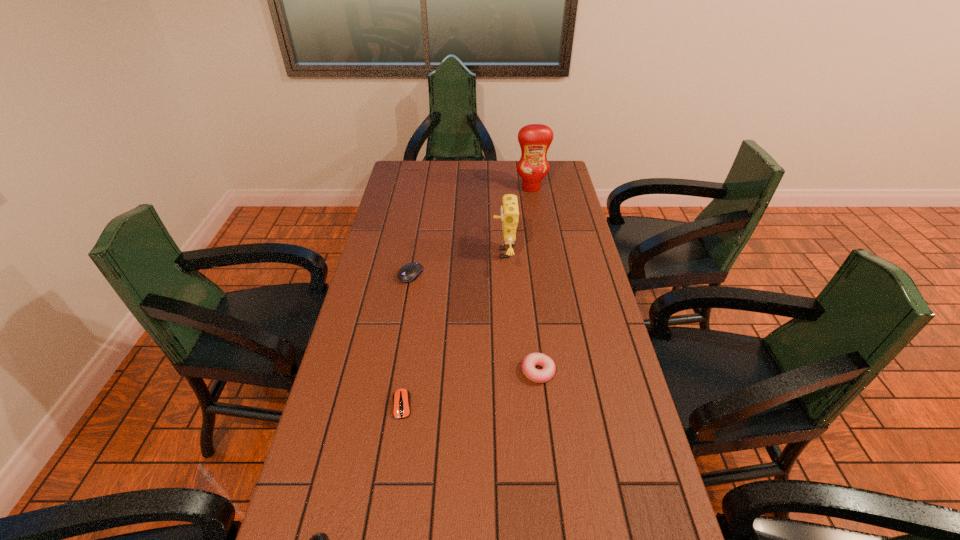
The image size is (960, 540). I want to click on vacant space at the far left corner, so click(x=422, y=173).

At what (x,y) coordinates should I click in order to perform the action: click on vacant point located between the condiment and the second nearest computer mouse. Please return your answer as a coordinate pair (x, y). Looking at the image, I should click on (467, 296).

Image resolution: width=960 pixels, height=540 pixels. I want to click on vacant space that's between the doughnut and the second nearest computer mouse, so click(470, 388).

Where is `free spot between the farthest computer mouse and the third nearest object`? The height and width of the screenshot is (540, 960). free spot between the farthest computer mouse and the third nearest object is located at coordinates (474, 323).

You are a GUI agent. You are given a task and a screenshot of the screen. Output one action in this format:
    pyautogui.click(x=<x>, y=<y>)
    Task: Click on the vacant area between the fifth farthest object and the tallest computer mouse
    This screenshot has width=960, height=540.
    Given the screenshot: What is the action you would take?
    pyautogui.click(x=406, y=340)

You are a GUI agent. You are given a task and a screenshot of the screen. Output one action in this format:
    pyautogui.click(x=<x>, y=<y>)
    Task: Click on the unoccupied area between the tallest computer mouse and the sponge
    This screenshot has width=960, height=540.
    Given the screenshot: What is the action you would take?
    [457, 264]

Find the location of a particular element. free space between the fourth farthest object and the fifth farthest object is located at coordinates (470, 388).

Locate an element on the screen. The image size is (960, 540). free space between the second nearest object and the sponge is located at coordinates (453, 329).

Where is `vacant space that's between the second farthest computer mouse and the tallest object`? This screenshot has height=540, width=960. vacant space that's between the second farthest computer mouse and the tallest object is located at coordinates (467, 296).

Locate which object is the third closest to the second farthest computer mouse. Please provide its 2D coordinates. Your answer should be formatted as a tuple, i.e. [(x, y)], where the tuple contains the x and y coordinates of a point satisfying the conditions above.

[(409, 272)]